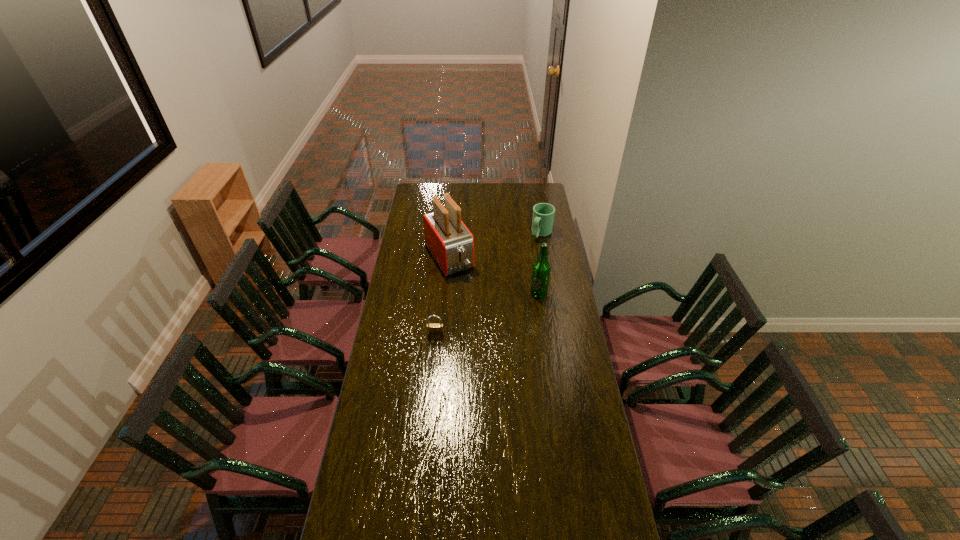
The width and height of the screenshot is (960, 540). I want to click on free space located on the side of the third tallest object with the handle, so click(x=518, y=267).

Identify the location of vacant position located on the side of the third tallest object with the handle. Image resolution: width=960 pixels, height=540 pixels. (512, 277).

The width and height of the screenshot is (960, 540). In order to click on vacant area situated on the side of the third tallest object with the handle in this screenshot , I will do `click(519, 266)`.

The image size is (960, 540). I want to click on object that is at the left edge, so click(450, 242).

Where is `beer bottle present at the right edge`? beer bottle present at the right edge is located at coordinates (541, 269).

Locate an element on the screen. Image resolution: width=960 pixels, height=540 pixels. mug at the right edge is located at coordinates (543, 213).

In the image, there is a desktop. Find the location of `vacant space at the far edge`. vacant space at the far edge is located at coordinates (472, 193).

In the image, there is a desktop. Where is `blank space at the left edge`? The height and width of the screenshot is (540, 960). blank space at the left edge is located at coordinates (371, 446).

What are the coordinates of `free space at the right edge` in the screenshot? It's located at pos(575,383).

Where is `free location at the far left corner`? Image resolution: width=960 pixels, height=540 pixels. free location at the far left corner is located at coordinates (420, 198).